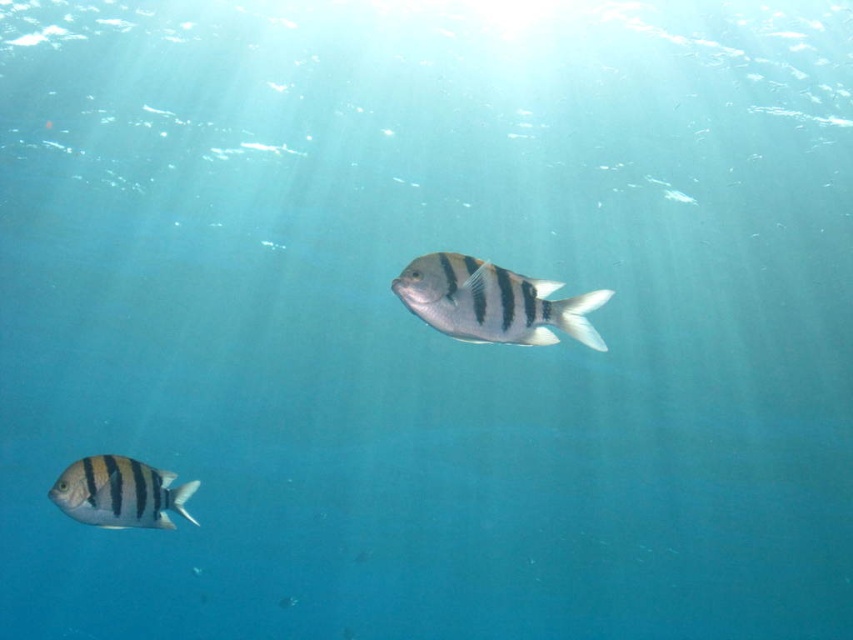
Which is more to the left, silver metallic fish at center or striped matte fish at lower left?

From the viewer's perspective, striped matte fish at lower left appears more on the left side.

Which is more to the right, silver metallic fish at center or striped matte fish at lower left?

silver metallic fish at center

Describe the element at coordinates (492, 301) in the screenshot. I see `silver metallic fish at center` at that location.

I want to click on silver metallic fish at center, so click(x=492, y=301).